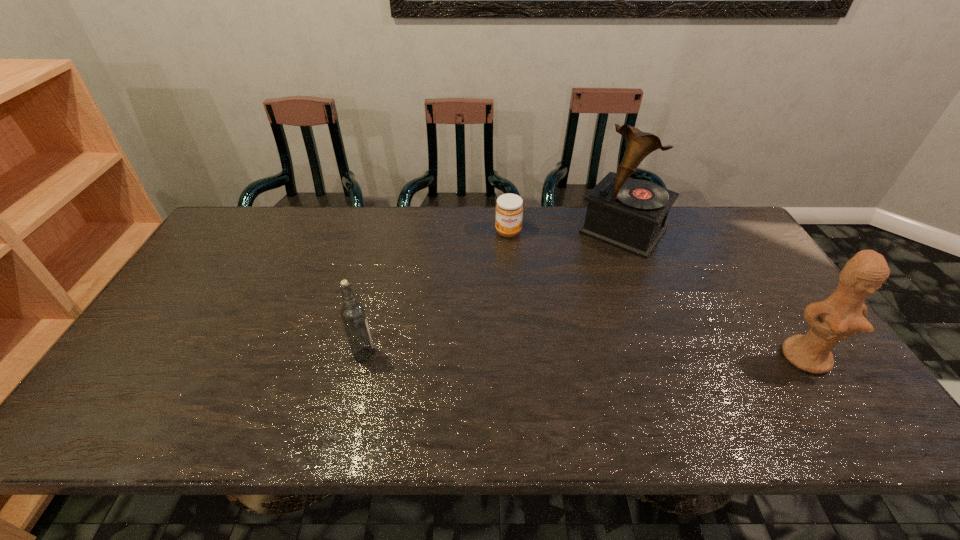
You are a GUI agent. You are given a task and a screenshot of the screen. Output one action in this format:
    pyautogui.click(x=<x>, y=<y>)
    Task: Click on the vacant space that's between the second tallest object and the jam
    
    Given the screenshot: What is the action you would take?
    pyautogui.click(x=658, y=295)

The height and width of the screenshot is (540, 960). What are the coordinates of `free space between the second tallest object and the phonograph_record` in the screenshot? It's located at (714, 294).

Where is `empty space between the third tallest object and the figurine`? empty space between the third tallest object and the figurine is located at coordinates (586, 356).

At what (x,y) coordinates should I click in order to perform the action: click on free space between the phonograph_record and the leftmost object. Please return your answer as a coordinate pair (x, y). This screenshot has height=540, width=960. Looking at the image, I should click on (493, 293).

Select which object is the closest to the rightmost object. Please provide its 2D coordinates. Your answer should be formatted as a tuple, i.e. [(x, y)], where the tuple contains the x and y coordinates of a point satisfying the conditions above.

[(629, 214)]

In order to click on object identified as the closest to the phonograph_record in this screenshot , I will do `click(509, 209)`.